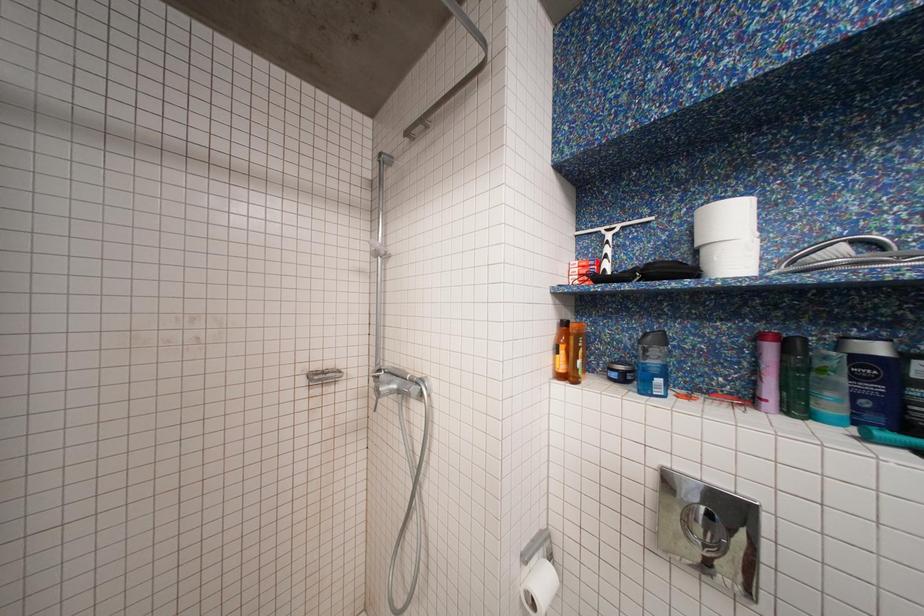
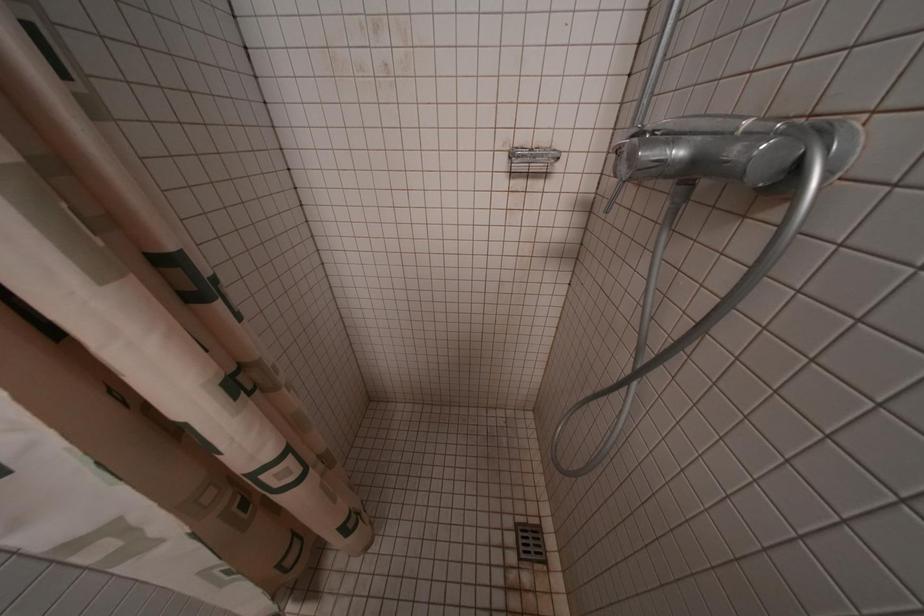
First-person continuous shooting, in which direction is the camera rotating?

The rotation direction of the camera is left-down.